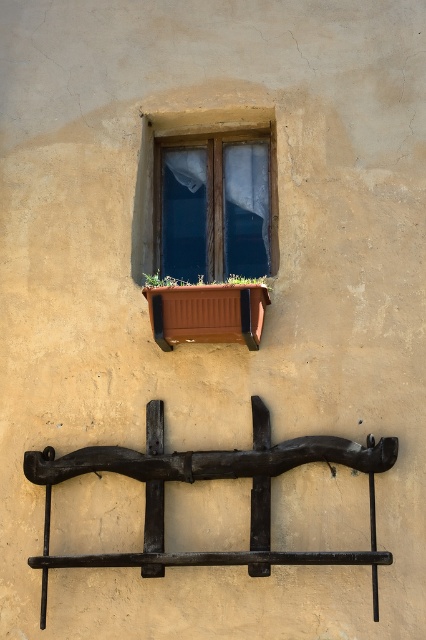
Consider the image. You are a gardener who wants to hang a new plant holder between the brown wooden planter at center and the green leafy plant at center. Since you need to know which one is taller to decide placement, can you tell me which one is taller?

The brown wooden planter at center is taller than the green leafy plant at center.

You are a painter standing at the base of the wall. You need to reach two points on the wall to touch them up. The first point is point (x=351, y=561) and the second is point (x=164, y=278). Which point should you reach first to minimize the distance you walk?

Point (x=351, y=561) is in front of point (x=164, y=278), so you should reach point (x=351, y=561) first as it is closer to you.